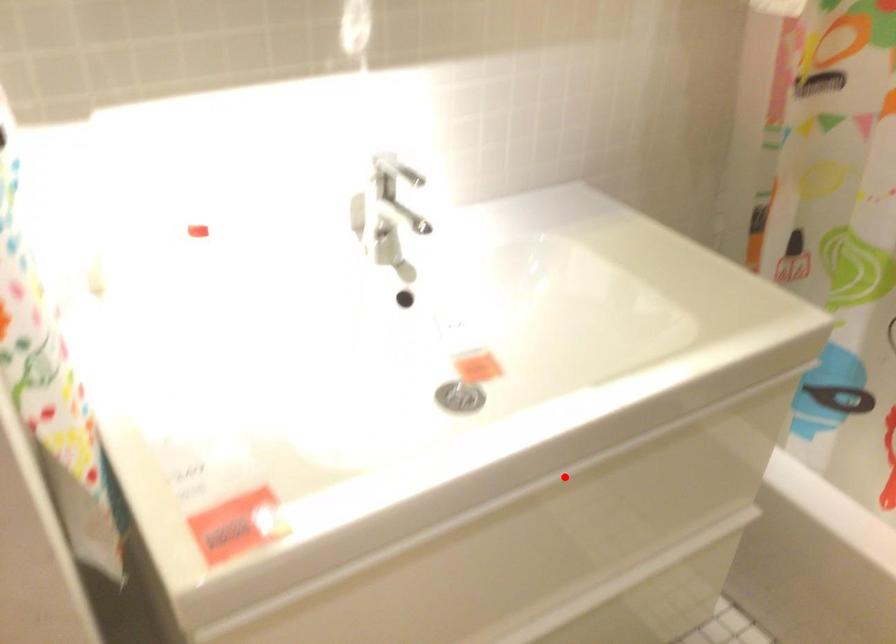
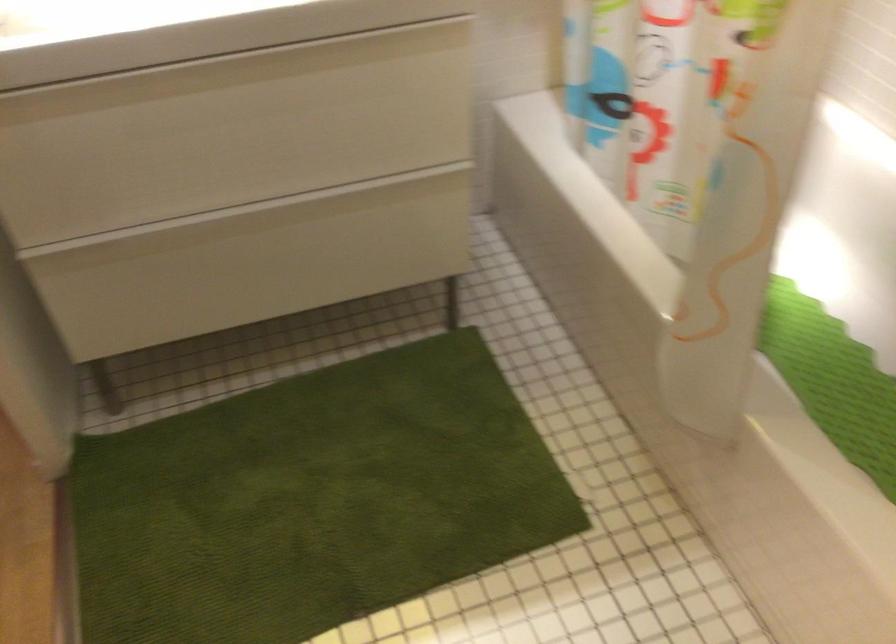
Locate, in the second image, the point that corresponds to the highlighted location in the first image.

(228, 70)